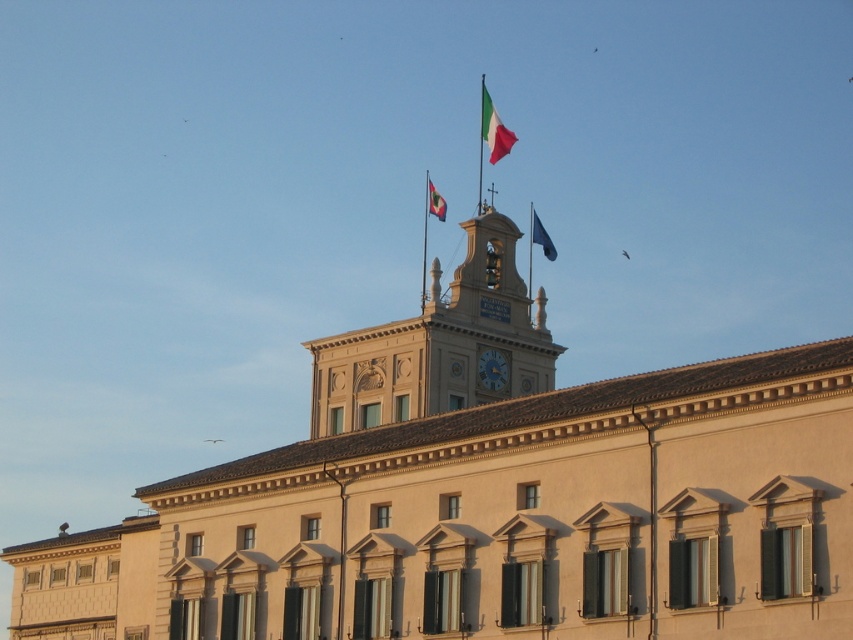
You are an architect analyzing the building facade. You notice the red fabric flag at upper center and the matte gold clock at center. Which object is located higher up on the building?

The red fabric flag at upper center is positioned over the matte gold clock at center, meaning it is higher up on the building.

You are an architect inspecting the building facade. You notice two flags, the red fabric flag at upper center and the blue fabric flag at upper center. Which flag is positioned higher on the building?

The red fabric flag at upper center is positioned higher than the blue fabric flag at upper center.

You are a window cleaner standing on a platform that can extend up to 30 feet. You need to clean both the red fabric flag at upper center and the matte red flag at upper center. Can your platform reach both flags?

The red fabric flag at upper center is 28.60 feet from matte red flag at upper center. Since the platform can extend up to 30 feet, it can reach both flags as the distance between them is within the platform extension limit.